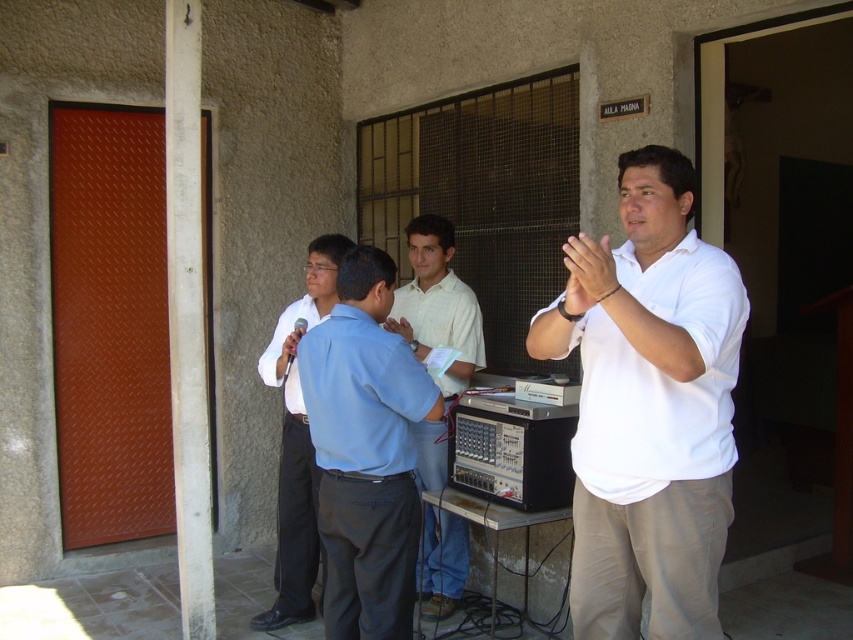
Question: Is light blue shirt at center below white smooth shirt at center?

Choices:
 (A) no
 (B) yes

Answer: (B)

Question: Is white matte shirt at center smaller than matte white shirt at center?

Choices:
 (A) yes
 (B) no

Answer: (A)

Question: Estimate the real-world distances between objects in this image. Which object is farther from the matte white shirt at center?

Choices:
 (A) white smooth shirt at center
 (B) light blue shirt at center

Answer: (B)

Question: Among these objects, which one is nearest to the camera?

Choices:
 (A) matte white shirt at center
 (B) white smooth shirt at center

Answer: (A)

Question: Which object is positioned closest to the white matte shirt at center?

Choices:
 (A) matte white shirt at center
 (B) light blue shirt at center

Answer: (B)

Question: From the image, what is the correct spatial relationship of light blue shirt at center in relation to white smooth shirt at center?

Choices:
 (A) below
 (B) above

Answer: (A)